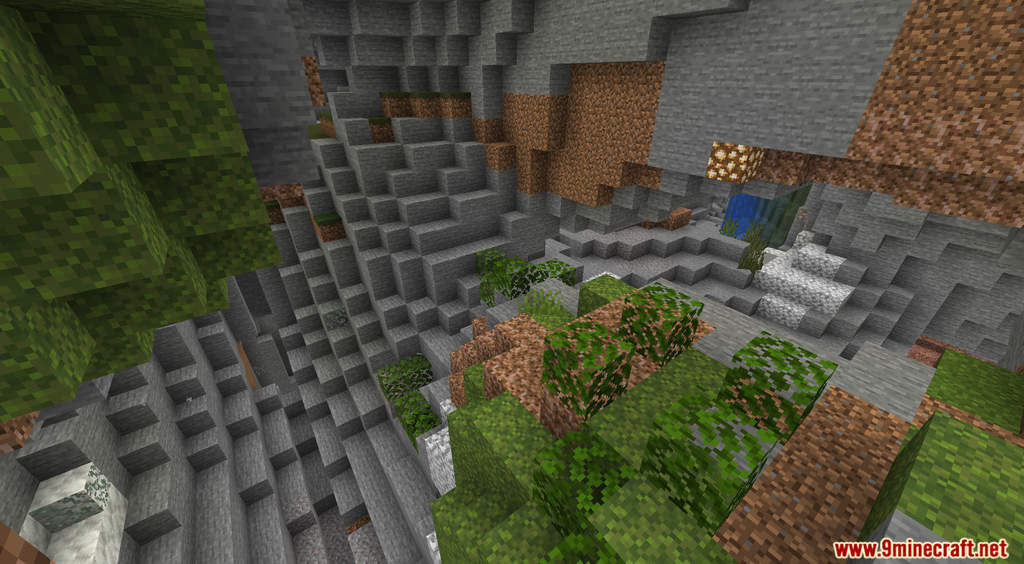
I want to click on wall, so click(938, 146), click(721, 164), click(538, 158), click(370, 132).